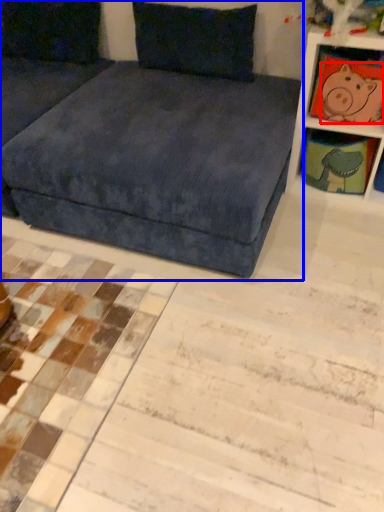
Question: Which point is closer to the camera, animal (highlighted by a red box) or studio couch (highlighted by a blue box)?

Choices:
 (A) animal
 (B) studio couch

Answer: (B)